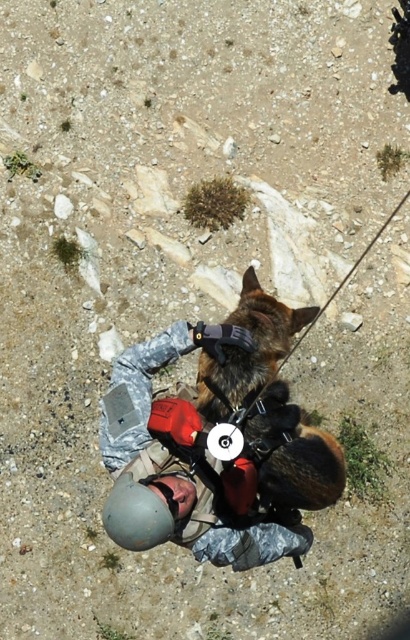
Question: Can you confirm if camouflage uniform at center is positioned above gray matte helmet at lower center?

Choices:
 (A) yes
 (B) no

Answer: (A)

Question: Does camouflage uniform at center lie behind gray matte helmet at lower center?

Choices:
 (A) yes
 (B) no

Answer: (A)

Question: Which point appears farthest from the camera in this image?

Choices:
 (A) (111, 522)
 (B) (123, 392)

Answer: (B)

Question: Which point is closer to the camera?

Choices:
 (A) camouflage uniform at center
 (B) gray matte helmet at lower center

Answer: (B)

Question: Does camouflage uniform at center appear on the right side of gray matte helmet at lower center?

Choices:
 (A) yes
 (B) no

Answer: (A)